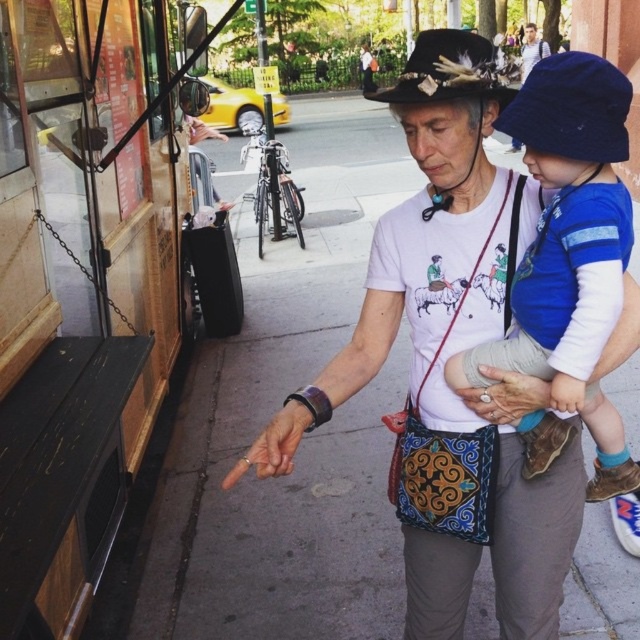
Question: Which point is closer to the camera taking this photo?

Choices:
 (A) (468, 35)
 (B) (592, 164)

Answer: (B)

Question: Can you confirm if white cotton t-shirt at center is thinner than blue cotton hat at upper right?

Choices:
 (A) yes
 (B) no

Answer: (B)

Question: Does white cotton t-shirt at center lie in front of blue cotton hat at upper right?

Choices:
 (A) yes
 (B) no

Answer: (B)

Question: Where is blue cotton hat at upper right located in relation to black felt cowboy hat at upper center in the image?

Choices:
 (A) left
 (B) right

Answer: (A)

Question: Based on their relative distances, which object is farther from the blue cotton hat at upper right?

Choices:
 (A) black felt cowboy hat at upper center
 (B) white cotton t-shirt at center

Answer: (A)

Question: Based on their relative distances, which object is nearer to the black felt cowboy hat at upper center?

Choices:
 (A) white cotton t-shirt at center
 (B) blue cotton hat at upper right

Answer: (B)